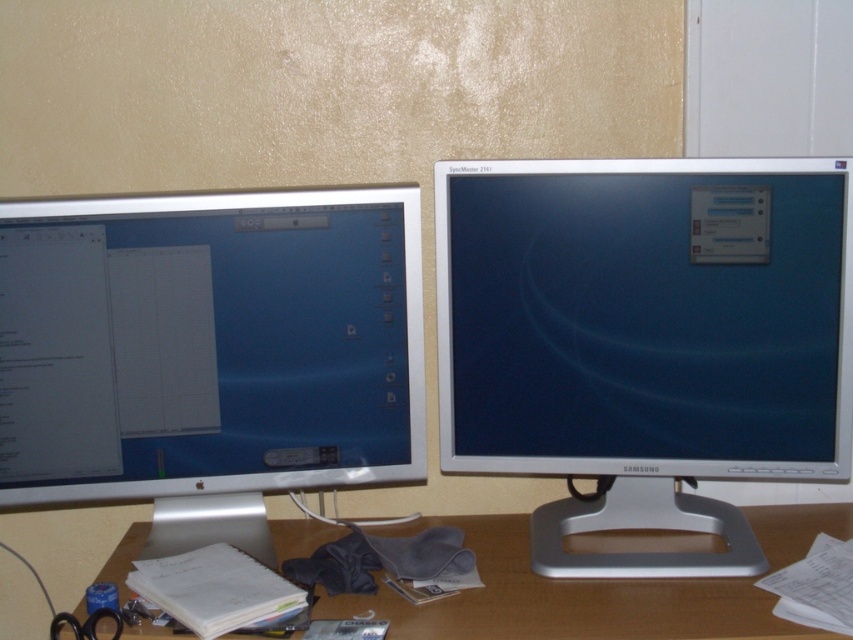
You are a delivery person who needs to place a small package on the desk between the two monitors. The package must be placed closer to the viewer than both monitors. Can you place it between the two points given by the coordinates point (x=155, y=310) and point (x=534, y=577)?

Point (x=155, y=310) is closer to the viewer than point (x=534, y=577). Therefore, the package can be placed between these two points as long as it is closer to the viewer than the farther point. However, since the package must be closer than both monitors, ensure it is placed near point (x=155, y=310) where it is still between them.

You have a ruler that is 12 inches long. You want to measure the space between the silver metallic monitor at left and the wooden desk at lower center. Will your ruler be long enough to measure the distance?

The distance between the silver metallic monitor at left and the wooden desk at lower center is 11.66 inches. Since the ruler is 12 inches long, it will be long enough to measure the space between them.

You are setting up a new webcam on your desk and want to position it so it can capture both the silver metallic monitor at left and the Samsung SyncMaster 2141 monitor on the right. Based on their positions, where should you place the webcam to ensure both monitors are in frame?

The silver metallic monitor at left is located at point (209, 353). To capture both monitors, position the webcam centrally between their positions, ensuring both are within the camera view.